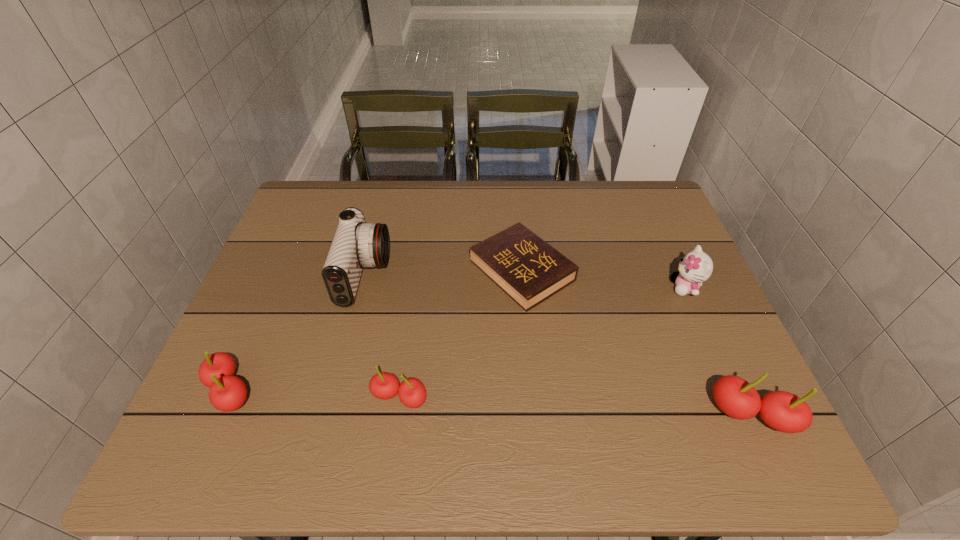
Find the location of `object located in the near right corner section of the desktop`. object located in the near right corner section of the desktop is located at coordinates (783, 411).

Locate an element on the screen. vacant space at the far edge of the desktop is located at coordinates (588, 219).

Locate an element on the screen. This screenshot has height=540, width=960. vacant area at the near edge is located at coordinates (547, 379).

Where is `vacant space at the left edge of the desktop`? vacant space at the left edge of the desktop is located at coordinates (266, 303).

Identify the location of free point at the right edge. This screenshot has height=540, width=960. (672, 366).

Find the location of a particular element. This screenshot has width=960, height=540. free space at the far left corner of the desktop is located at coordinates (341, 183).

Find the location of a particular element. The height and width of the screenshot is (540, 960). vacant space at the far right corner of the desktop is located at coordinates (633, 219).

You are a GUI agent. You are given a task and a screenshot of the screen. Output one action in this format:
    pyautogui.click(x=<x>, y=<y>)
    Task: Click on the empty space between the leftmost object and the camcorder
    The height and width of the screenshot is (540, 960).
    Given the screenshot: What is the action you would take?
    pyautogui.click(x=298, y=333)

Locate an element on the screen. This screenshot has height=540, width=960. empty space that is in between the leftmost object and the fourth object from left to right is located at coordinates (376, 330).

The width and height of the screenshot is (960, 540). What are the coordinates of `free space between the rightmost cherry and the camcorder` in the screenshot? It's located at (558, 345).